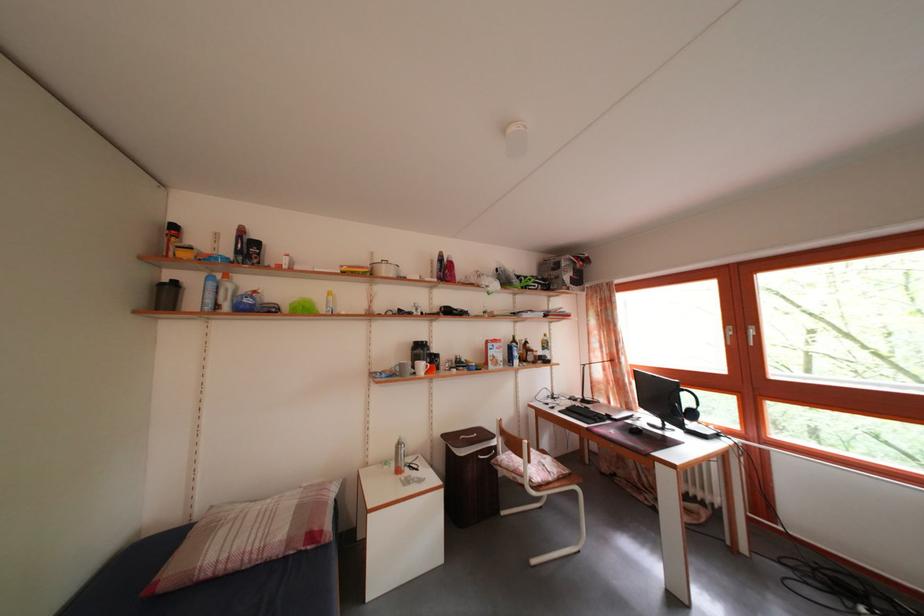
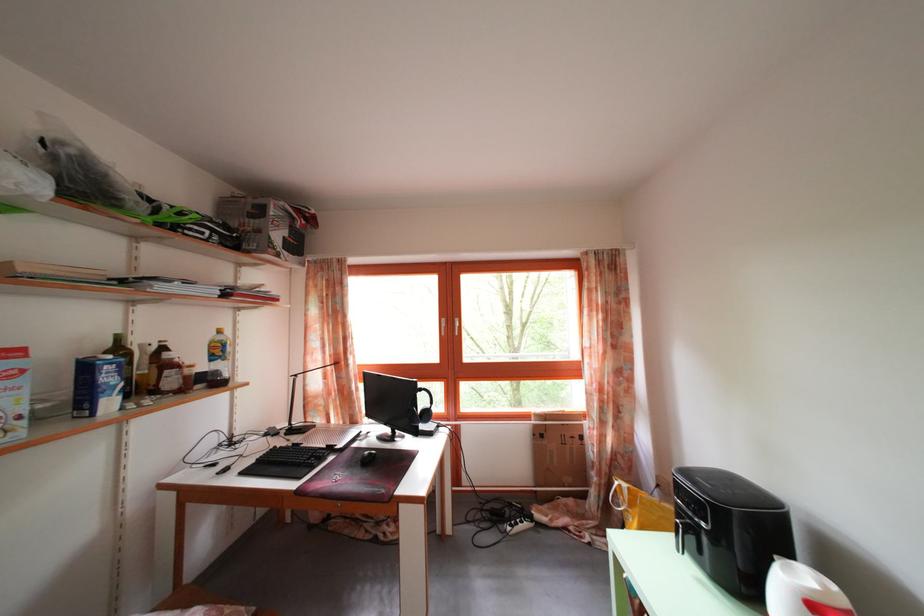
Where in the second image is the point corresponding to the point at 524,369 from the first image?

(117, 410)